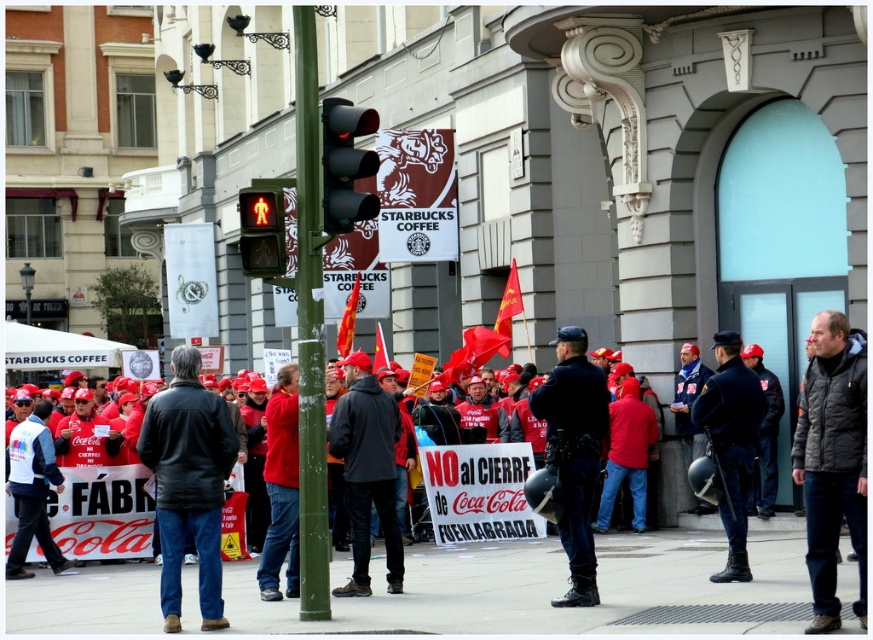
Question: Is black uniform helmet at center thinner than black matte traffic light at center?

Choices:
 (A) no
 (B) yes

Answer: (B)

Question: Based on their relative distances, which object is farther from the dark gray jacket at center?

Choices:
 (A) dark blue uniform at center
 (B) green textured pole at center
 (C) red glass pedestrian signal at upper center

Answer: (C)

Question: Is dark gray textured jacket at lower right bigger than black uniform helmet at center?

Choices:
 (A) no
 (B) yes

Answer: (B)

Question: Observing the image, what is the correct spatial positioning of green textured pole at center in reference to red glass pedestrian signal at upper center?

Choices:
 (A) below
 (B) above

Answer: (B)

Question: Which point appears closest to the camera in this image?

Choices:
 (A) (394, 620)
 (B) (262, 211)
 (C) (325, 109)
 (D) (375, 408)

Answer: (A)

Question: Which of these objects is positioned farthest from the black matte traffic light at center?

Choices:
 (A) black uniform helmet at center
 (B) dark gray jacket at center
 (C) dark gray textured jacket at lower right
 (D) dark blue uniform at center

Answer: (A)